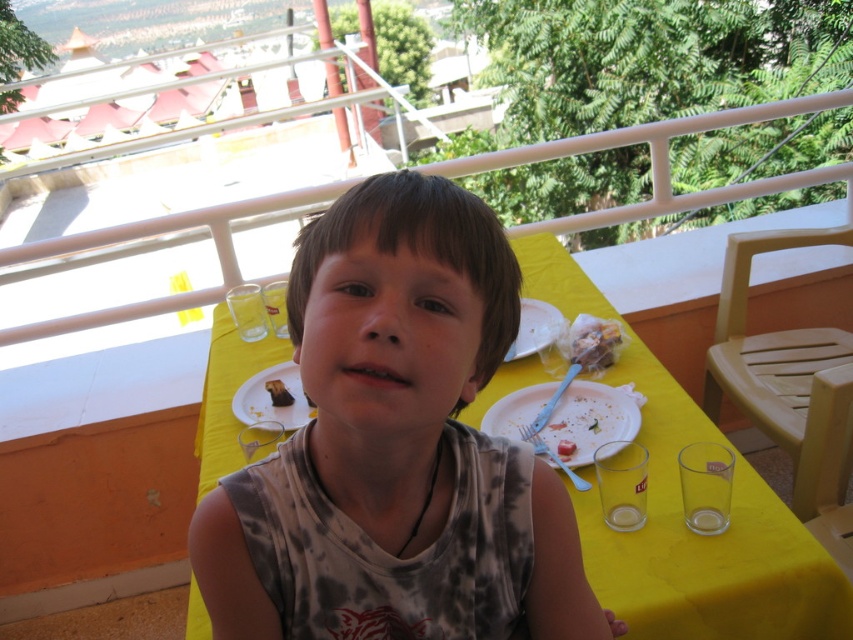
Does white paper plate at upper center appear under blue plastic fork at lower center?

No.

Which is in front, point (543, 340) or point (564, 470)?

Point (564, 470) is more forward.

Locate an element on the screen. The width and height of the screenshot is (853, 640). white paper plate at upper center is located at coordinates coord(535,328).

Which is behind, point (538, 429) or point (560, 452)?

The point (538, 429) is more distant.

Looking at this image, can you confirm if blue plastic fork at lower center is positioned to the right of white crumbly cake at center?

Incorrect, blue plastic fork at lower center is not on the right side of white crumbly cake at center.

Where is `blue plastic fork at lower center`? blue plastic fork at lower center is located at coordinates (550, 456).

Who is higher up, blue plastic fork at lower center or chocolate cake at center?

chocolate cake at center is higher up.

Who is more forward, (531, 422) or (277, 394)?

Positioned in front is point (531, 422).

The image size is (853, 640). What do you see at coordinates (550, 456) in the screenshot?
I see `blue plastic fork at lower center` at bounding box center [550, 456].

Where is `blue plastic fork at lower center`? blue plastic fork at lower center is located at coordinates [x=550, y=456].